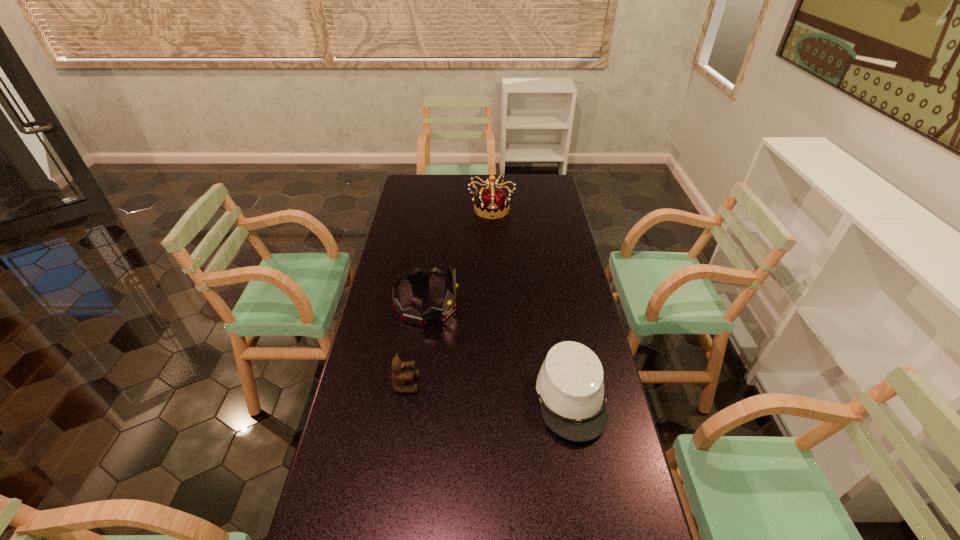
Where is `the farthest object`? The width and height of the screenshot is (960, 540). the farthest object is located at coordinates (492, 202).

Locate an element on the screen. Image resolution: width=960 pixels, height=540 pixels. the farther tiara is located at coordinates (492, 202).

Locate an element on the screen. Image resolution: width=960 pixels, height=540 pixels. the nearer tiara is located at coordinates (419, 277).

In order to click on the third nearest object in this screenshot , I will do [419, 277].

Locate an element on the screen. Image resolution: width=960 pixels, height=540 pixels. teddy bear is located at coordinates (399, 377).

The image size is (960, 540). Find the location of `hat`. hat is located at coordinates (570, 386).

In order to click on blank area located 0.060m on the front-facing side of the taller tiara in this screenshot , I will do `click(492, 228)`.

Image resolution: width=960 pixels, height=540 pixels. Identify the location of vacant point located 0.120m at the front of the shorter tiara with jewels. (492, 305).

Identify the location of vacant point located 0.220m on the face of the teddy bear. (492, 384).

Find the location of a particular element. The height and width of the screenshot is (540, 960). vacant point located on the front-facing side of the rightmost object is located at coordinates (586, 480).